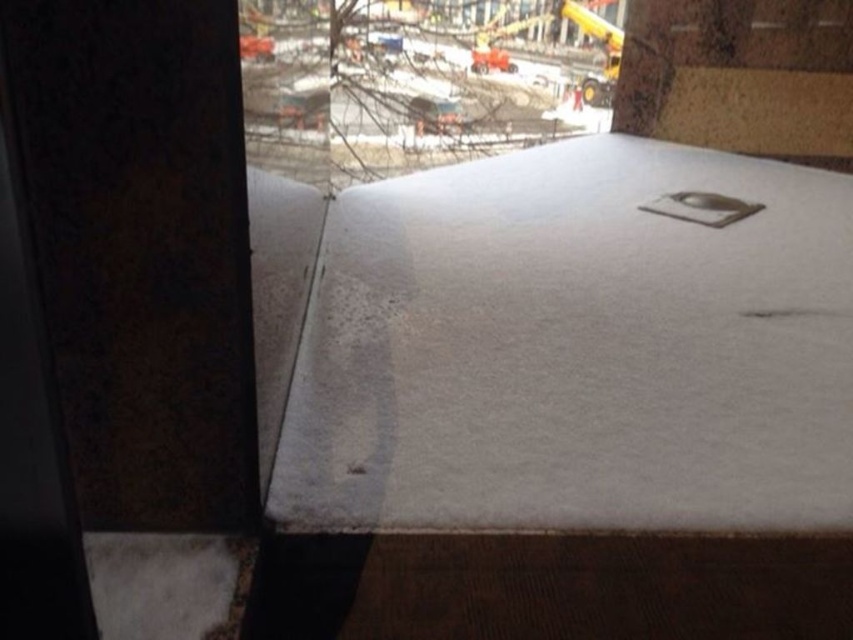
Question: Does transparent glass window at upper center have a greater width compared to white cardboard box at upper right?

Choices:
 (A) yes
 (B) no

Answer: (B)

Question: Which object is farther from the camera taking this photo?

Choices:
 (A) transparent glass window at upper center
 (B) white matte blanket at center
 (C) white cardboard box at upper right

Answer: (C)

Question: Which point is farther from the camera taking this photo?

Choices:
 (A) (544, 1)
 (B) (648, 67)

Answer: (A)

Question: Does transparent glass window at upper center appear on the right side of white cardboard box at upper right?

Choices:
 (A) no
 (B) yes

Answer: (A)

Question: Which point is closer to the camera?

Choices:
 (A) transparent glass window at upper center
 (B) white cardboard box at upper right
 (C) white matte blanket at center

Answer: (A)

Question: Can you confirm if white matte blanket at center is positioned to the left of transparent glass window at upper center?

Choices:
 (A) no
 (B) yes

Answer: (A)